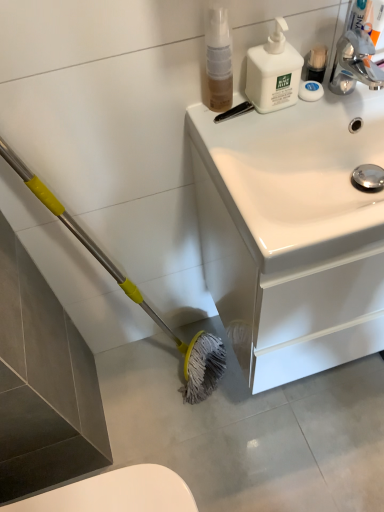
Question: From a real-world perspective, is translucent plastic spray bottle at upper center, marked as the 1th cleaning product in a left-to-right arrangement, physically below white matte pump bottle at upper right, the second cleaning product in the left-to-right sequence?

Choices:
 (A) no
 (B) yes

Answer: (A)

Question: Is translucent plastic spray bottle at upper center, marked as the 1th cleaning product in a left-to-right arrangement, completely or partially outside of white matte pump bottle at upper right, the second cleaning product in the left-to-right sequence?

Choices:
 (A) no
 (B) yes

Answer: (B)

Question: Is translucent plastic spray bottle at upper center, marked as the 1th cleaning product in a left-to-right arrangement, smaller than white matte pump bottle at upper right, the second cleaning product in the left-to-right sequence?

Choices:
 (A) no
 (B) yes

Answer: (B)

Question: Does translucent plastic spray bottle at upper center, placed as the 2th cleaning product when sorted from right to left, lie behind white matte pump bottle at upper right, the second cleaning product in the left-to-right sequence?

Choices:
 (A) yes
 (B) no

Answer: (B)

Question: From the image's perspective, would you say translucent plastic spray bottle at upper center, marked as the 1th cleaning product in a left-to-right arrangement, is shown under white matte pump bottle at upper right, which appears as the 1th cleaning product when viewed from the right?

Choices:
 (A) no
 (B) yes

Answer: (A)

Question: Considering their positions, is white matte soap at upper right located in front of or behind translucent plastic spray bottle at upper center, placed as the 2th cleaning product when sorted from right to left?

Choices:
 (A) front
 (B) behind

Answer: (B)

Question: From the image's perspective, relative to translucent plastic spray bottle at upper center, marked as the 1th cleaning product in a left-to-right arrangement, is white matte soap at upper right above or below?

Choices:
 (A) below
 (B) above

Answer: (A)

Question: Is white matte soap at upper right inside the boundaries of translucent plastic spray bottle at upper center, placed as the 2th cleaning product when sorted from right to left, or outside?

Choices:
 (A) outside
 (B) inside

Answer: (A)

Question: Is white matte soap at upper right bigger or smaller than translucent plastic spray bottle at upper center, placed as the 2th cleaning product when sorted from right to left?

Choices:
 (A) big
 (B) small

Answer: (B)

Question: In terms of width, does white matte pump bottle at upper right, the second cleaning product in the left-to-right sequence, look wider or thinner when compared to translucent plastic spray bottle at upper center, placed as the 2th cleaning product when sorted from right to left?

Choices:
 (A) wide
 (B) thin

Answer: (A)

Question: Is point (264, 111) closer or farther from the camera than point (216, 46)?

Choices:
 (A) closer
 (B) farther

Answer: (B)

Question: From the image's perspective, is white matte pump bottle at upper right, which appears as the 1th cleaning product when viewed from the right, positioned above or below translucent plastic spray bottle at upper center, placed as the 2th cleaning product when sorted from right to left?

Choices:
 (A) below
 (B) above

Answer: (A)

Question: From a real-world perspective, is white matte pump bottle at upper right, which appears as the 1th cleaning product when viewed from the right, physically located above or below translucent plastic spray bottle at upper center, marked as the 1th cleaning product in a left-to-right arrangement?

Choices:
 (A) above
 (B) below

Answer: (B)

Question: From a real-world perspective, is translucent plastic spray bottle at upper center, placed as the 2th cleaning product when sorted from right to left, positioned above or below white glossy sink at upper right?

Choices:
 (A) below
 (B) above

Answer: (B)

Question: Does point (223, 53) appear closer or farther from the camera than point (279, 243)?

Choices:
 (A) farther
 (B) closer

Answer: (A)